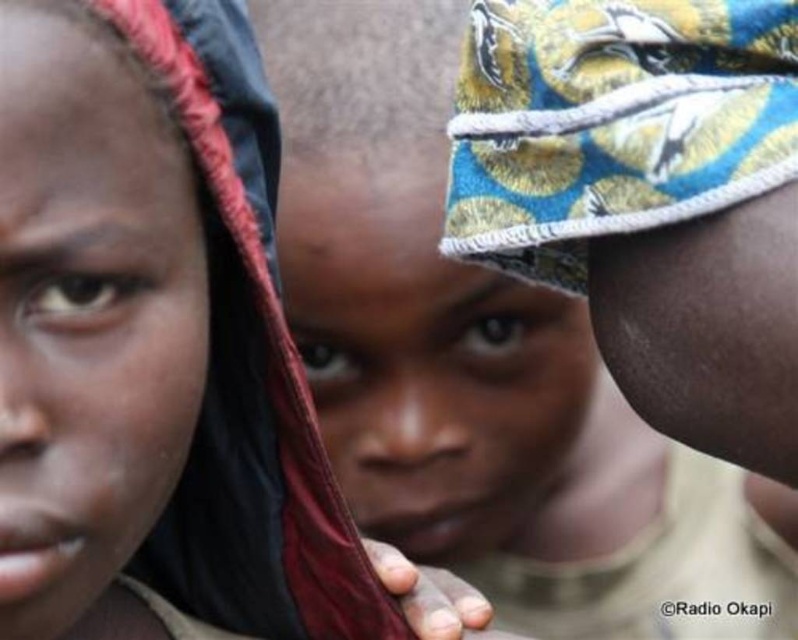
Consider the image. In the image, there are two points labeled as point 1 and point 2. Point 1 is located at the coordinates point (453, 24) and point 2 is at point (275, 458). If you were to draw a straight line between them, would this line cross any of the three individuals shown?

The line between point (453, 24) and point (275, 458) would cross the individual in the center since point (453, 24) is behind point (275, 458) according to the coordinates provided.

You are a photographer adjusting the camera focus. You need to focus on both the matte fabric headscarf at center and the matte black headscarf at left. Which one should you adjust the focus for first to ensure it appears sharp?

You should focus on the matte fabric headscarf at center first because it is closer to the viewer than the matte black headscarf at left, so adjusting focus starting from the closer object ensures both can be in focus.

In the scene shown: You are a photographer setting up for a group photo. You need to position the two headscarves so that there is at least 20 inches between them for proper framing. Based on the current positions of the matte fabric headscarf at center and the matte black headscarf at left, will you need to adjust their positions?

The matte fabric headscarf at center is 19.50 inches away from the matte black headscarf at left. Since the required distance is 20 inches, the current spacing is insufficient. You will need to move them slightly apart to achieve the desired separation.